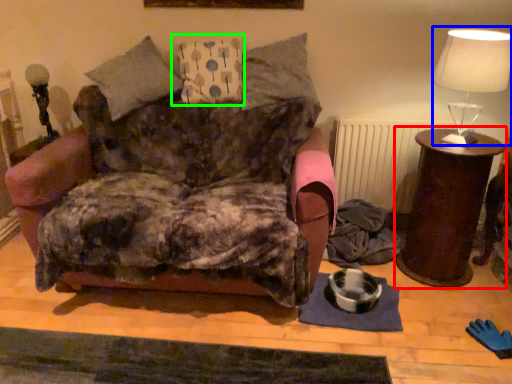
Question: Considering the real-world distances, which object is closest to nightstand (highlighted by a red box)? table lamp (highlighted by a blue box) or pillow (highlighted by a green box).

Choices:
 (A) table lamp
 (B) pillow

Answer: (A)